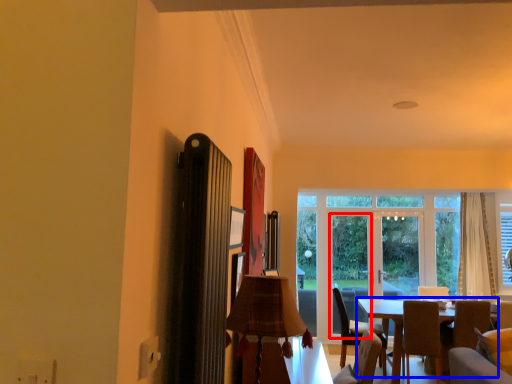
Question: Which point is closer to the camera, screen door (highlighted by a red box) or table (highlighted by a blue box)?

Choices:
 (A) screen door
 (B) table

Answer: (B)